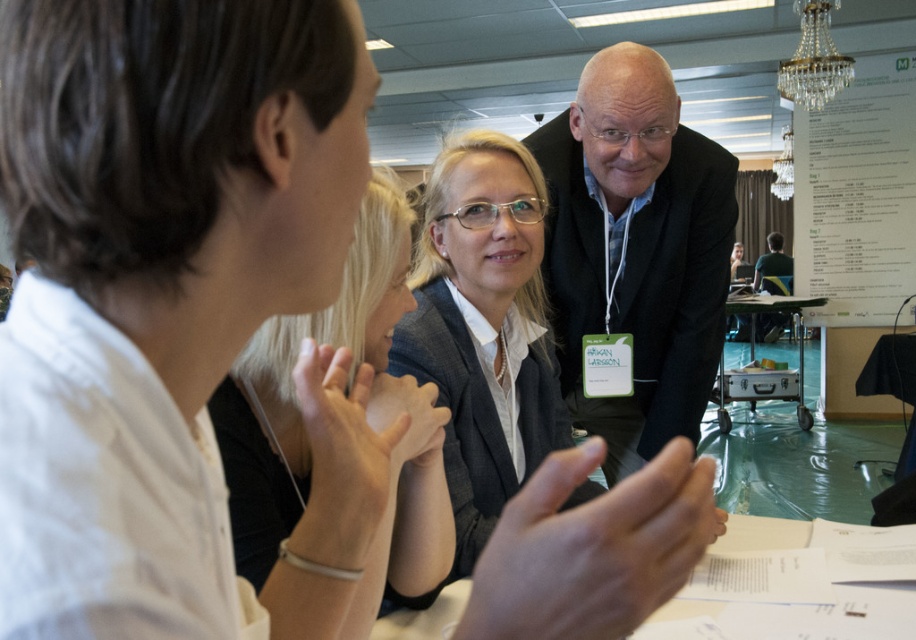
You are standing in the conference room and need to determine which of the two points, point (407, 461) or point (859, 284), is nearer to you. Based on the scene description, which point is closer?

Point (407, 461) is closer to the camera than point (859, 284), so it is closer to you.

You are organizing a business meeting and need to retrieve the green fabric shirt at center for a presentation. The metallic suitcase at center is blocking your path. Can you easily access the shirt without moving the suitcase?

The metallic suitcase at center is closer to the viewer than the green fabric shirt at center, so you would need to move the suitcase to access the shirt since it is in front of the shirt.

In the conference room scene, there are two women seated at a table and a man in the background. The metallic suitcase at center has a point at coordinates (759,365). If you were to draw a straight line from the man in the background to the point on the metallic suitcase, would it pass through either of the two women?

The point at coordinates (759,365) is on the metallic suitcase at center. Since the man is in the background and the suitcase is at the center, the line drawn from the man to the suitcase would not pass through either of the two women seated at the table in the foreground.